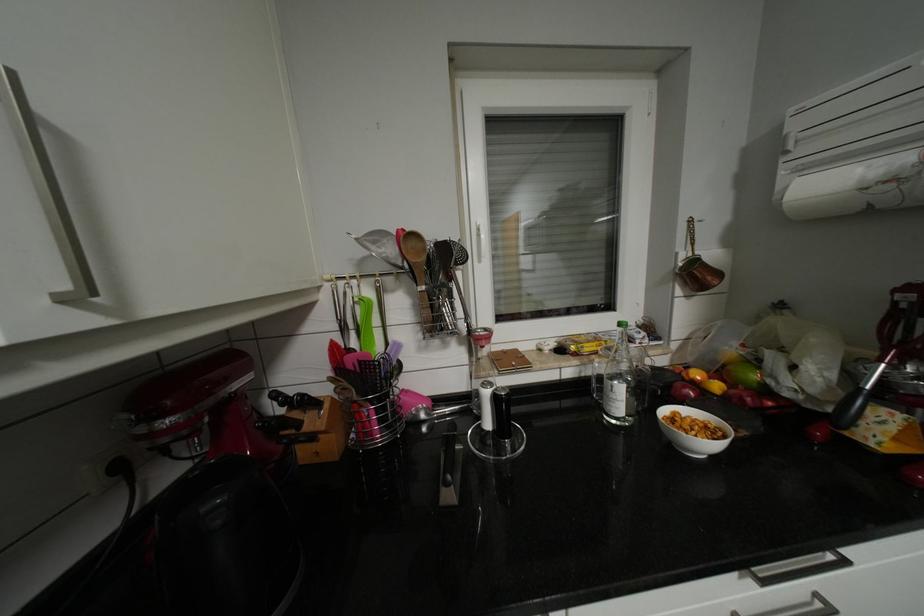
The location [618,382] corresponds to which object?

It refers to a clear glass bottle.